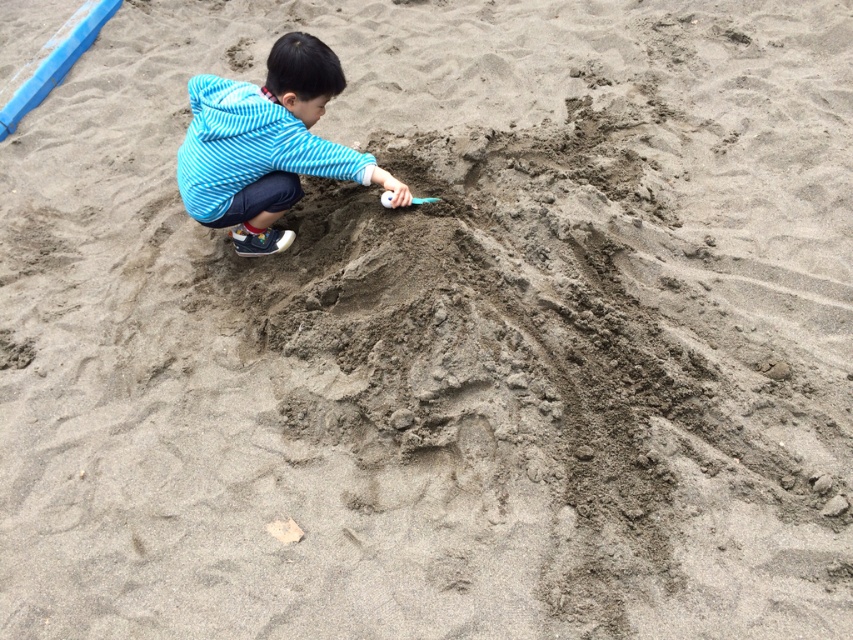
Between point (283, 60) and point (384, 195), which one is positioned behind?

Point (384, 195)

Does blue striped hoodie at upper left appear under smooth plastic shovel at center?

No.

Locate an element on the screen. blue striped hoodie at upper left is located at coordinates (265, 145).